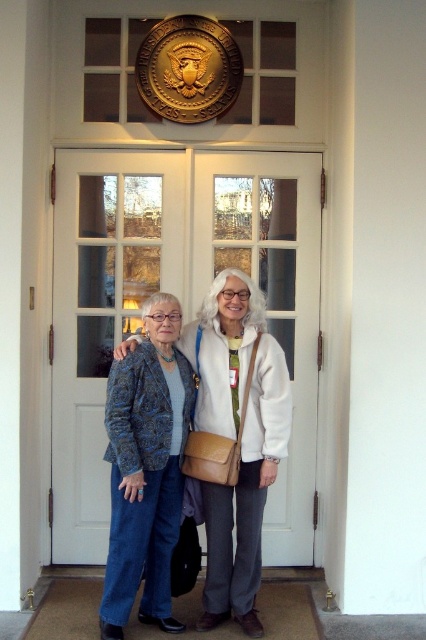
You are a photographer setting up for a group photo. You need to ensure that the white glossy door at center is fully visible in the frame. Given that the matte blue jacket at center is currently blocking part of the door, can you determine if adjusting the camera angle to the left will help capture the entire door?

The white glossy door at center is wider than the matte blue jacket at center. By adjusting the camera angle to the left, you can shift the frame to include more of the door while moving the matte blue jacket at center slightly out of the frame, ensuring the entire door is visible.

You are a photographer setting up for a group photo. You need to ensure that the white glossy door at center and the blue textured blazer at lower left are both visible in the frame. Given their sizes, which object should you prioritize positioning closer to the camera to maintain their visibility?

The blue textured blazer at lower left should be positioned closer to the camera since the white glossy door at center is larger and will remain visible even if slightly farther away.